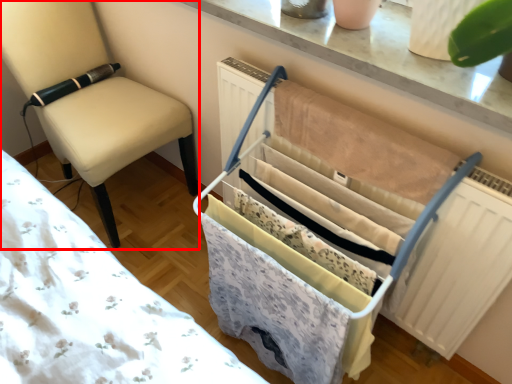
Question: From the image's perspective, where is chair (annotated by the red box) located in relation to baby carriage in the image?

Choices:
 (A) above
 (B) below

Answer: (A)